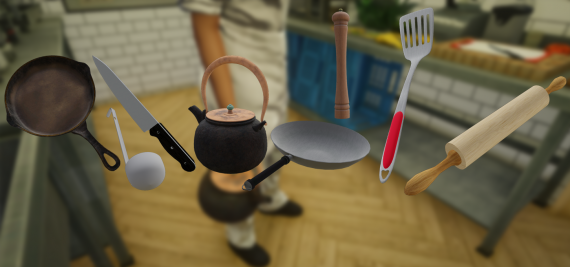
This screenshot has height=267, width=570. I want to click on green table, so click(x=451, y=67).